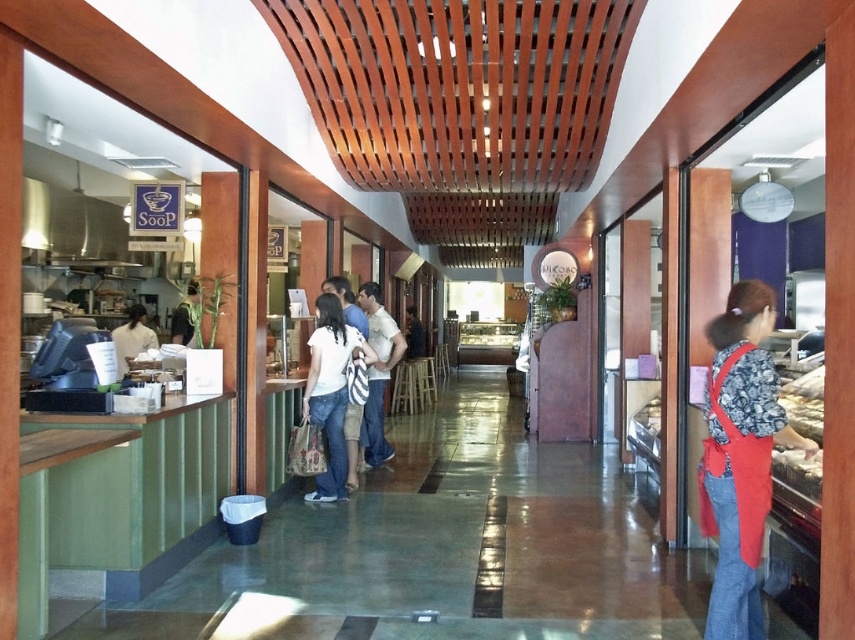
Is red fabric apron at right to the right of white cotton shirt at center from the viewer's perspective?

Correct, you'll find red fabric apron at right to the right of white cotton shirt at center.

Is red fabric apron at right positioned in front of white cotton shirt at center?

Yes, red fabric apron at right is in front of white cotton shirt at center.

Image resolution: width=855 pixels, height=640 pixels. In order to click on red fabric apron at right in this screenshot , I will do pyautogui.click(x=740, y=456).

Where is `red fabric apron at right`? The height and width of the screenshot is (640, 855). red fabric apron at right is located at coordinates (740, 456).

Does point (750, 442) lie in front of point (783, 406)?

Yes.

Between red fabric apron at right and white glossy bread at right, which one has more height?

With more height is red fabric apron at right.

This screenshot has height=640, width=855. Find the location of `red fabric apron at right`. red fabric apron at right is located at coordinates (740, 456).

Between point (319, 392) and point (127, 346), which one is positioned in front?

Point (319, 392) is more forward.

Which is above, white cotton shirt at center or white fabric shirt at left?

white fabric shirt at left

Where is `white cotton shirt at center`? This screenshot has height=640, width=855. white cotton shirt at center is located at coordinates (329, 388).